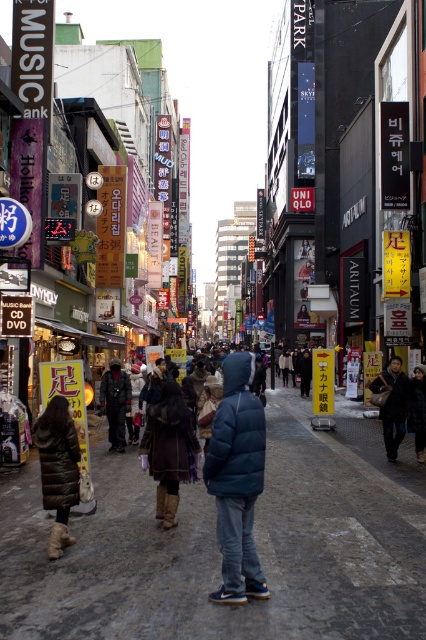
Is point (226, 627) positioned after point (172, 429)?

No, it is not.

Between matte blue jacket at center and brown leather jacket at center, which one appears on the left side from the viewer's perspective?

brown leather jacket at center is more to the left.

Identify the location of matte blue jacket at center. The height and width of the screenshot is (640, 426). (218, 550).

Is the position of brown leather jacket at center less distant than that of dark brown leather jacket at right?

Yes.

Is brown leather jacket at center to the right of dark brown leather jacket at right from the viewer's perspective?

No, brown leather jacket at center is not to the right of dark brown leather jacket at right.

Between point (175, 509) and point (405, 388), which one is positioned in front?

Point (175, 509)

Locate an element on the screen. The height and width of the screenshot is (640, 426). brown leather jacket at center is located at coordinates (169, 449).

Who is more forward, (x=222, y=630) or (x=226, y=451)?

Point (x=222, y=630)

At what (x,y) coordinates should I click in order to perform the action: click on matte blue jacket at center. Please return your answer as a coordinate pair (x, y). This screenshot has height=640, width=426. Looking at the image, I should click on (218, 550).

Where is `matte blue jacket at center`? matte blue jacket at center is located at coordinates (218, 550).